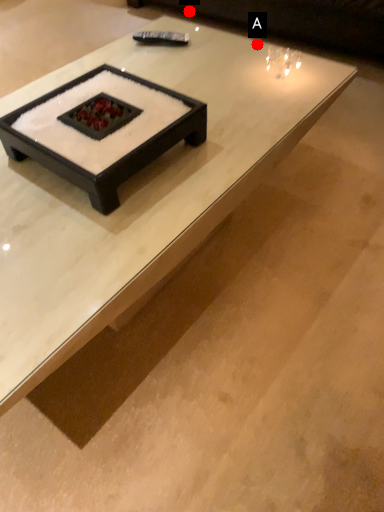
Question: Two points are circled on the image, labeled by A and B beside each circle. Which point is closer to the camera?

Choices:
 (A) A is closer
 (B) B is closer

Answer: (A)